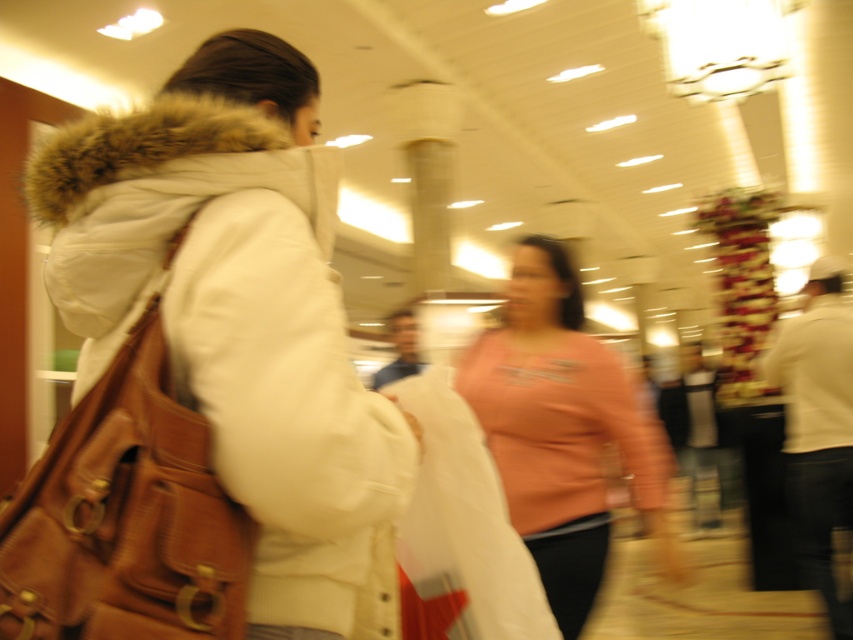
Is point (157, 145) positioned before point (567, 301)?

Yes, point (157, 145) is closer to viewer.

Does white fuzzy-lined jacket at left come behind pink fabric shirt at center?

No, it is not.

Does point (286, 532) come farther from viewer compared to point (577, 456)?

No.

Image resolution: width=853 pixels, height=640 pixels. I want to click on white fuzzy-lined jacket at left, so click(238, 333).

Is white fuzzy-lined jacket at left taller than brown leather bag at left?

Yes.

Does point (189, 320) come in front of point (91, 529)?

No, (189, 320) is behind (91, 529).

This screenshot has height=640, width=853. What do you see at coordinates (238, 333) in the screenshot?
I see `white fuzzy-lined jacket at left` at bounding box center [238, 333].

Locate an element on the screen. Image resolution: width=853 pixels, height=640 pixels. white fuzzy-lined jacket at left is located at coordinates (238, 333).

Can you confirm if brown leather bag at left is wider than pink fabric shirt at center?

In fact, brown leather bag at left might be narrower than pink fabric shirt at center.

Which of these two, brown leather bag at left or pink fabric shirt at center, stands taller?

With more height is pink fabric shirt at center.

Between point (45, 497) and point (653, 467), which one is positioned behind?

Positioned behind is point (653, 467).

Find the location of `brown leather bag at left`. brown leather bag at left is located at coordinates (125, 516).